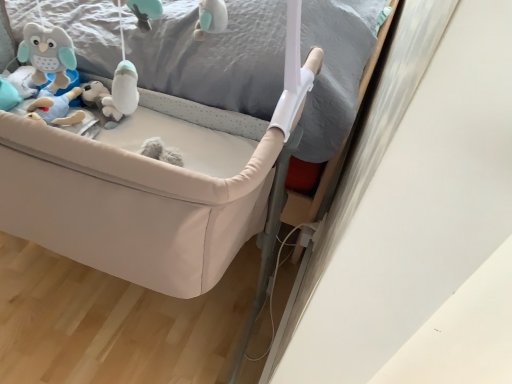
Question: From a real-world perspective, is beige fabric infant bed at center above or below beige fabric bed frame at center?

Choices:
 (A) above
 (B) below

Answer: (B)

Question: Relative to beige fabric bed frame at center, is beige fabric infant bed at center in front or behind?

Choices:
 (A) front
 (B) behind

Answer: (B)

Question: Is beige fabric infant bed at center inside the boundaries of beige fabric bed frame at center, or outside?

Choices:
 (A) inside
 (B) outside

Answer: (B)

Question: From the image's perspective, relative to beige fabric infant bed at center, is beige fabric bed frame at center above or below?

Choices:
 (A) below
 (B) above

Answer: (B)

Question: Based on their sizes in the image, would you say beige fabric bed frame at center is bigger or smaller than beige fabric infant bed at center?

Choices:
 (A) big
 (B) small

Answer: (B)

Question: In terms of width, does beige fabric bed frame at center look wider or thinner when compared to beige fabric infant bed at center?

Choices:
 (A) wide
 (B) thin

Answer: (B)

Question: In terms of height, does beige fabric bed frame at center look taller or shorter compared to beige fabric infant bed at center?

Choices:
 (A) short
 (B) tall

Answer: (A)